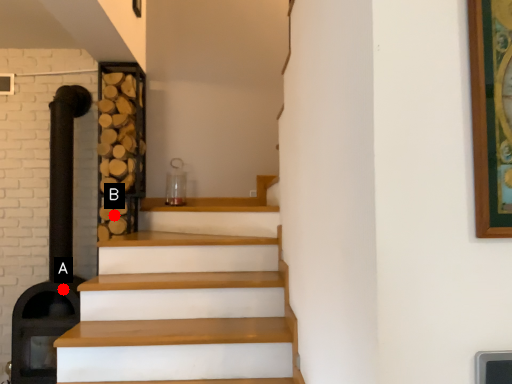
Question: Two points are circled on the image, labeled by A and B beside each circle. Which point is farther from the camera taking this photo?

Choices:
 (A) A is further
 (B) B is further

Answer: (B)